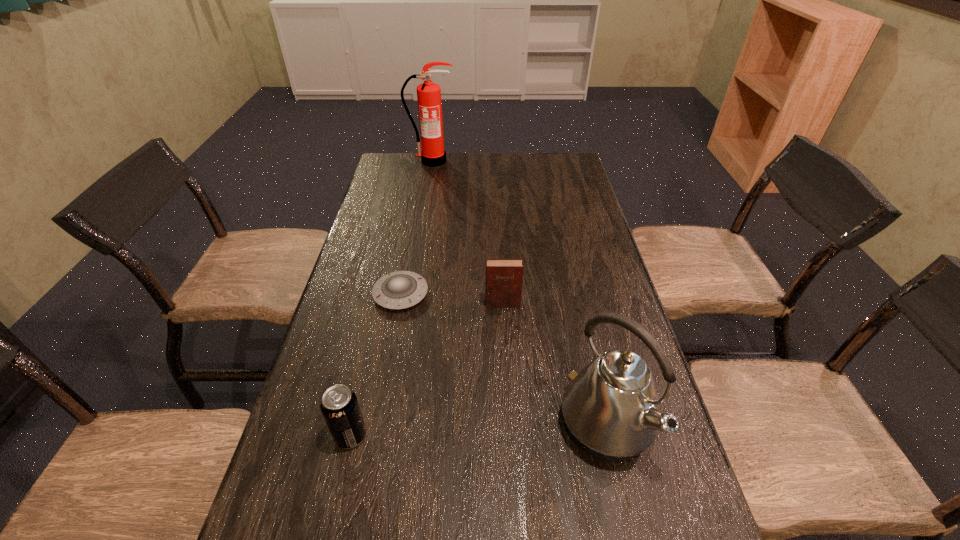
Where is `vacant space at the right edge of the desktop`? Image resolution: width=960 pixels, height=540 pixels. vacant space at the right edge of the desktop is located at coordinates (669, 491).

Image resolution: width=960 pixels, height=540 pixels. Identify the location of free space at the far left corner of the desktop. (408, 183).

In order to click on vacant space at the far right corner of the desktop in this screenshot , I will do `click(568, 155)`.

This screenshot has height=540, width=960. Find the location of `free spot between the second tallest object and the soda can`. free spot between the second tallest object and the soda can is located at coordinates (478, 431).

Image resolution: width=960 pixels, height=540 pixels. I want to click on vacant space in between the fire extinguisher and the shortest object, so click(417, 227).

This screenshot has width=960, height=540. What are the coordinates of `blank region between the soda can and the shortest object` in the screenshot? It's located at (375, 364).

Locate an element on the screen. The height and width of the screenshot is (540, 960). free space that is in between the soda can and the diary is located at coordinates (426, 370).

You are a GUI agent. You are given a task and a screenshot of the screen. Output one action in this format:
    pyautogui.click(x=<x>, y=<y>)
    Task: Click on the free space that is in between the rightmost object and the saucer
    The height and width of the screenshot is (540, 960).
    Given the screenshot: What is the action you would take?
    pyautogui.click(x=503, y=360)

The width and height of the screenshot is (960, 540). Find the location of `free spot between the saucer and the kettle`. free spot between the saucer and the kettle is located at coordinates coord(503,360).

In order to click on free space between the saucer and the fourth shortest object in this screenshot , I will do click(x=503, y=360).